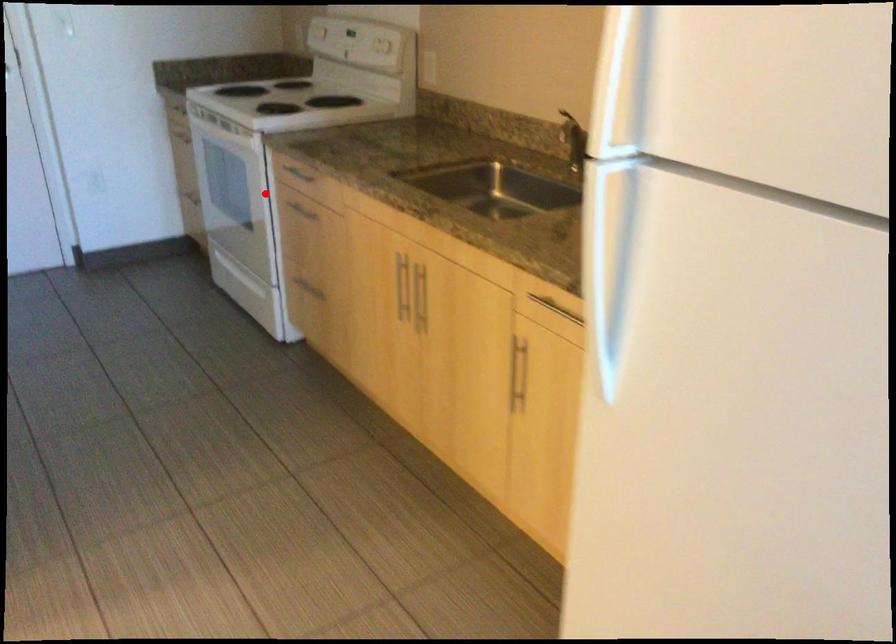
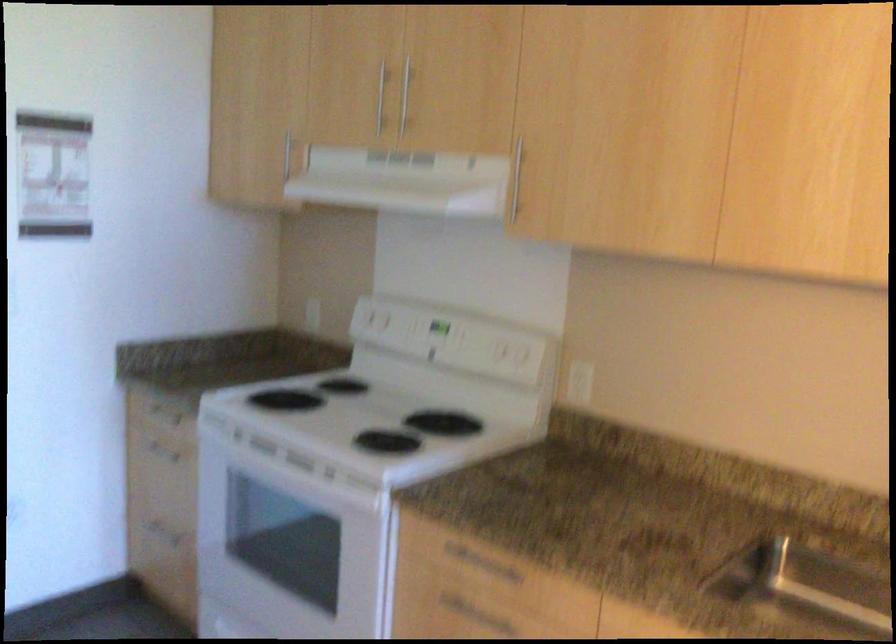
Locate, in the second image, the point that corresponds to the highlighted location in the first image.

(385, 571)